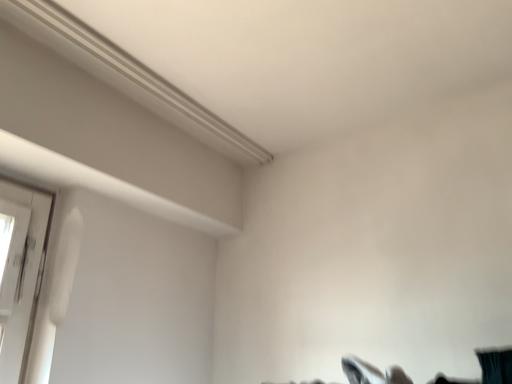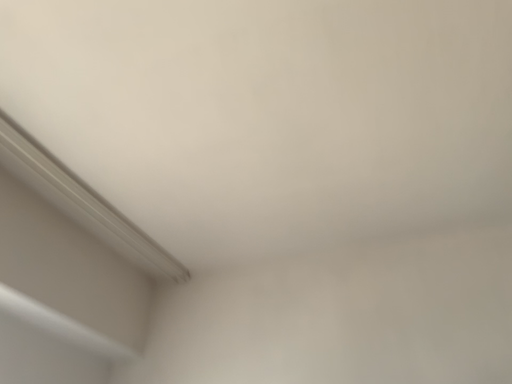
Question: How did the camera likely rotate when shooting the video?

Choices:
 (A) rotated upward
 (B) rotated downward

Answer: (A)